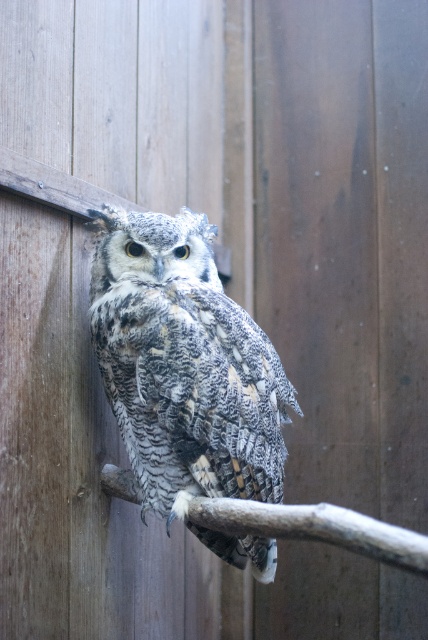
Question: Does speckled feathered owl at center have a smaller size compared to smooth brown branch at center?

Choices:
 (A) yes
 (B) no

Answer: (B)

Question: Which point appears closest to the camera in this image?

Choices:
 (A) (336, 540)
 (B) (187, 349)

Answer: (A)

Question: Is speckled feathered owl at center further to camera compared to smooth brown branch at center?

Choices:
 (A) no
 (B) yes

Answer: (B)

Question: Is speckled feathered owl at center above smooth brown branch at center?

Choices:
 (A) yes
 (B) no

Answer: (A)